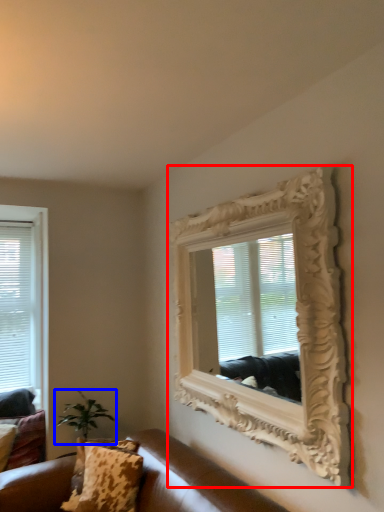
Question: Which point is closer to the camera, picture frame (highlighted by a red box) or houseplant (highlighted by a blue box)?

Choices:
 (A) picture frame
 (B) houseplant

Answer: (A)